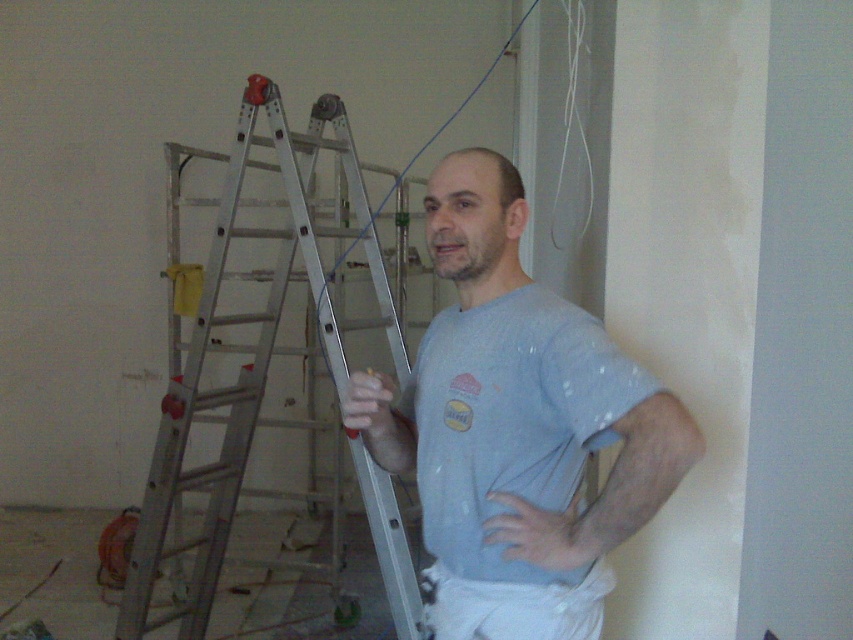
Question: Estimate the real-world distances between objects in this image. Which object is closer to the light blue cotton t-shirt at center?

Choices:
 (A) light blue cotton shirt at center
 (B) silver metallic ladder at left

Answer: (A)

Question: Can you confirm if light blue cotton shirt at center is positioned above light blue cotton t-shirt at center?

Choices:
 (A) yes
 (B) no

Answer: (A)

Question: Which point is closer to the camera taking this photo?

Choices:
 (A) (311, 237)
 (B) (422, 397)

Answer: (B)

Question: Based on their relative distances, which object is nearer to the silver metallic ladder at left?

Choices:
 (A) light blue cotton t-shirt at center
 (B) light blue cotton shirt at center

Answer: (B)

Question: Can you confirm if silver metallic ladder at left is smaller than light blue cotton t-shirt at center?

Choices:
 (A) yes
 (B) no

Answer: (B)

Question: Is light blue cotton shirt at center positioned before light blue cotton t-shirt at center?

Choices:
 (A) yes
 (B) no

Answer: (A)